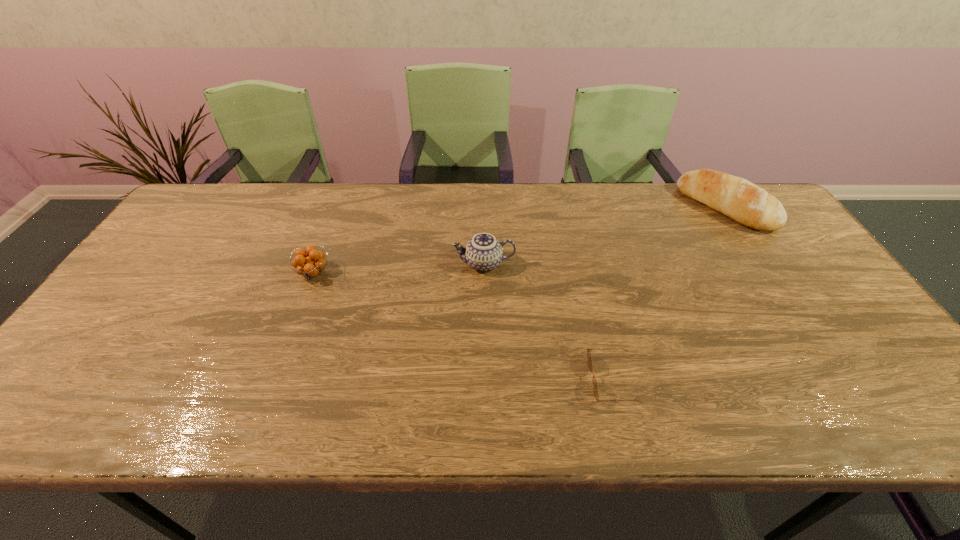
The image size is (960, 540). I want to click on bread, so click(737, 198).

This screenshot has height=540, width=960. Find the location of `the farthest object`. the farthest object is located at coordinates (737, 198).

Locate an element on the screen. This screenshot has width=960, height=540. chinaware is located at coordinates (483, 252).

Locate an element on the screen. The image size is (960, 540). the leftmost object is located at coordinates (311, 268).

The image size is (960, 540). Find the location of `the second shortest object`. the second shortest object is located at coordinates (311, 268).

Where is `the shortest object`? The width and height of the screenshot is (960, 540). the shortest object is located at coordinates (589, 358).

Locate an element on the screen. Image resolution: width=960 pixels, height=540 pixels. sunglasses is located at coordinates (589, 358).

Where is `vacant point located 0.340m on the front of the farthest object`? vacant point located 0.340m on the front of the farthest object is located at coordinates (801, 322).

Locate an element on the screen. blank area located from the spout of the chinaware is located at coordinates (330, 264).

Locate an element on the screen. This screenshot has height=540, width=960. vacant position located from the spout of the chinaware is located at coordinates (313, 264).